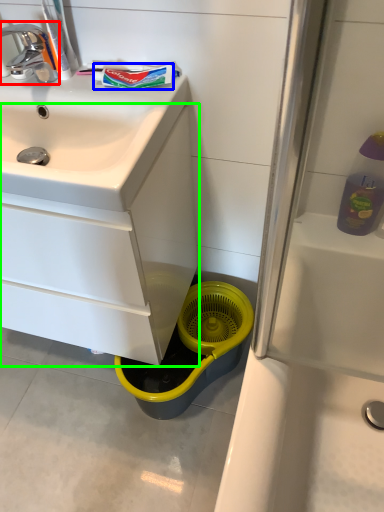
Question: Considering the real-world distances, which object is farthest from tap (highlighted by a red box)? toothpaste (highlighted by a blue box) or bathroom cabinet (highlighted by a green box)?

Choices:
 (A) toothpaste
 (B) bathroom cabinet

Answer: (B)